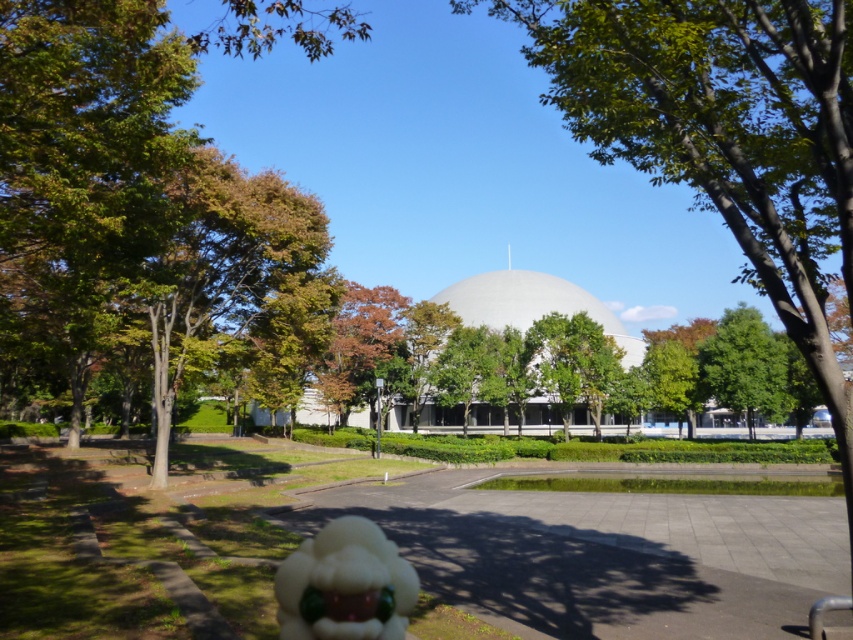
You are a visitor in the park and see the white fluffy toy at lower center and the green leafy tree at right. Which object is taller?

The green leafy tree at right is taller than the white fluffy toy at lower center.

You are planning to take a photo of the white smooth dome at center and the green leafy tree at right from a distance. Which object will appear taller in the photo?

The white smooth dome at center will appear taller in the photo because it has a greater height compared to the green leafy tree at right.